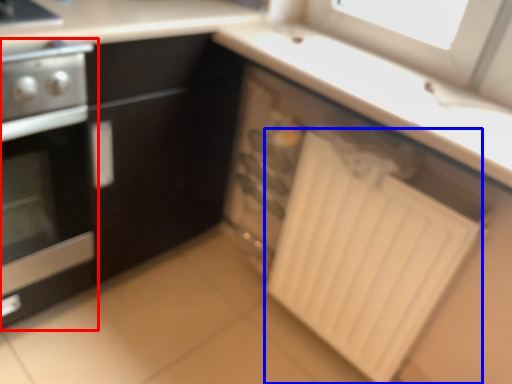
Question: Among these objects, which one is farthest to the camera, home appliance (highlighted by a red box) or radiator (highlighted by a blue box)?

Choices:
 (A) home appliance
 (B) radiator

Answer: (B)